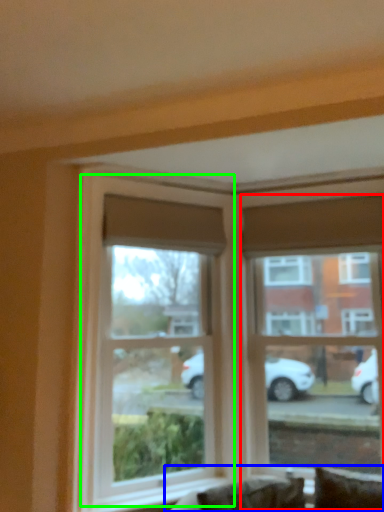
Question: Considering the real-world distances, which object is closest to window (highlighted by a red box)? couch (highlighted by a blue box) or window (highlighted by a green box).

Choices:
 (A) couch
 (B) window

Answer: (B)